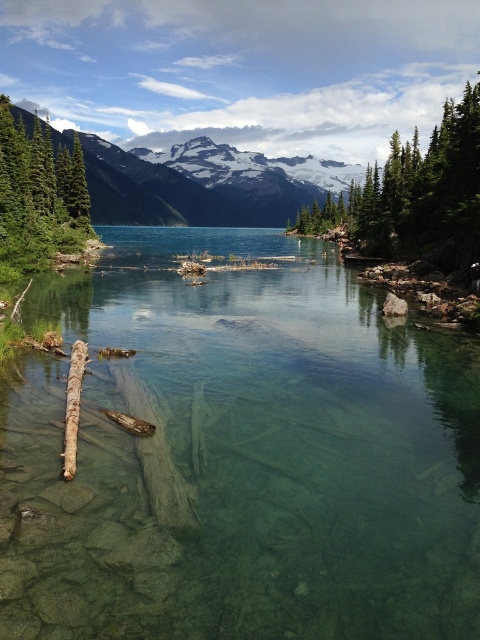
You are a hiker standing at the edge of the clear glassy water at center. You want to reach the base of the snowy granite mountain at upper center. According to the map, the path directly towards the mountain is 370.60 meters long. Is this path the shortest possible route between the two points?

Yes, the path directly towards the snowy granite mountain at upper center is the shortest route since the straight line distance between the clear glassy water at center and the snowy granite mountain at upper center is exactly 370.60 meters.

You are standing at the edge of the lake and want to find the clear glassy water at center. According to the coordinates provided, in which direction should you look relative to your position?

The clear glassy water at center is located at point coordinates, so you should look towards the center of the lake to find it.